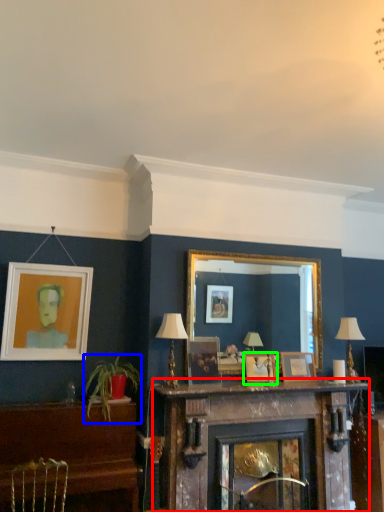
Question: Which object is positioned closest to fireplace (highlighted by a red box)? Select from houseplant (highlighted by a blue box) and picture frame (highlighted by a green box).

Choices:
 (A) houseplant
 (B) picture frame

Answer: (B)